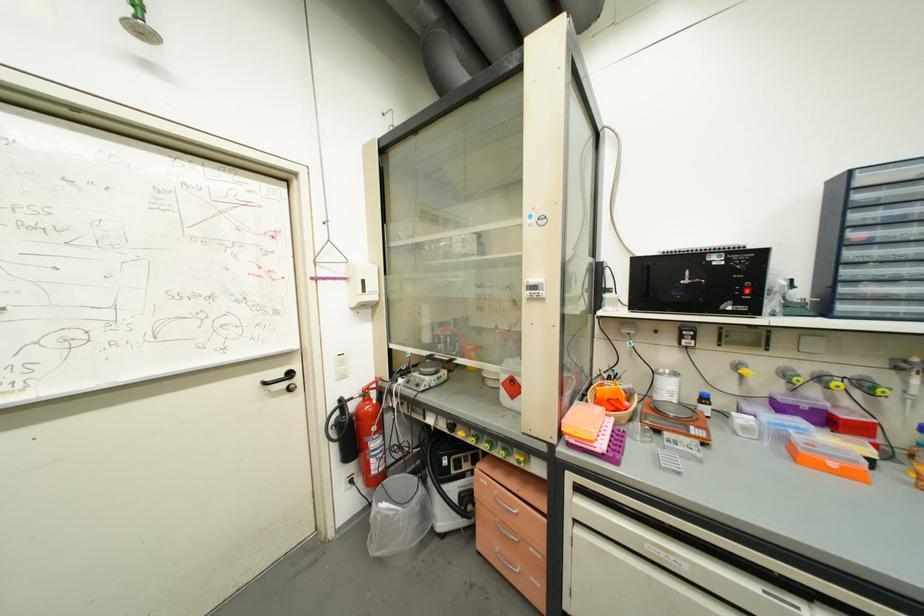
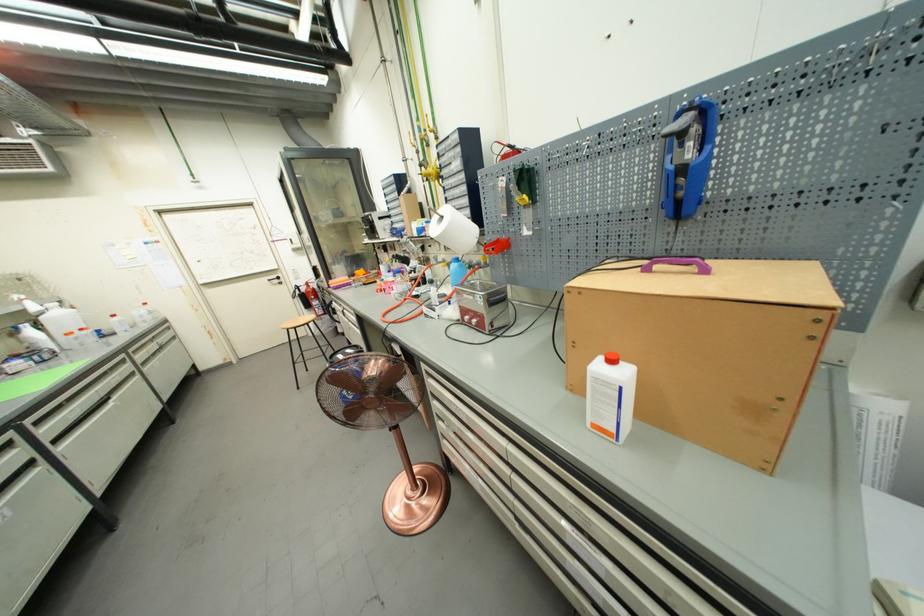
Find the pixel in the second image that matches the point at 358,408 in the first image.

(309, 291)